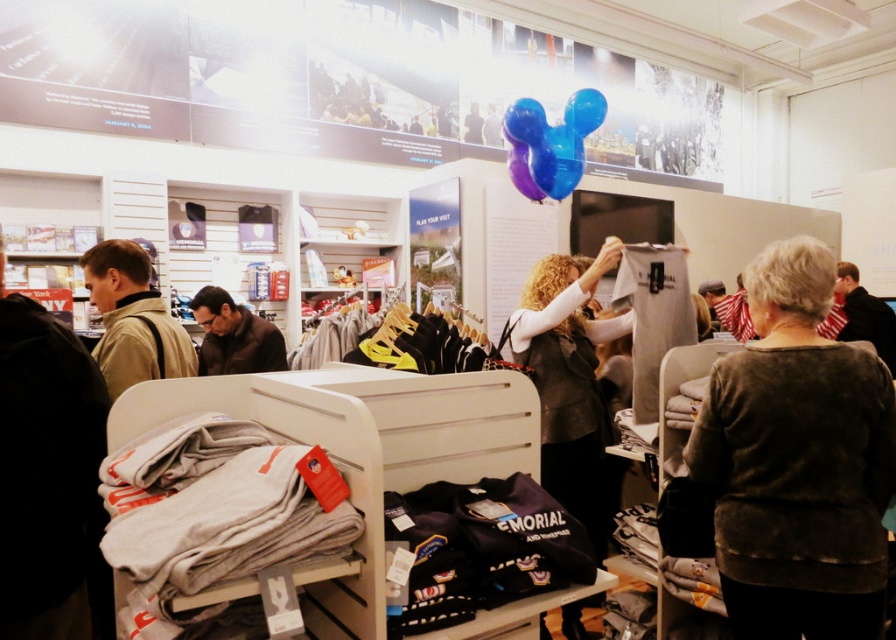
You are standing in the souvenir shop and need to grab the tan fabric jacket at left and the translucent blue balloon at upper center. If you can only reach items within 8 feet, can you reach both without moving?

The tan fabric jacket at left is 7.89 feet away from the translucent blue balloon at upper center. Since the distance between them is less than 8 feet, you can reach both items without moving.